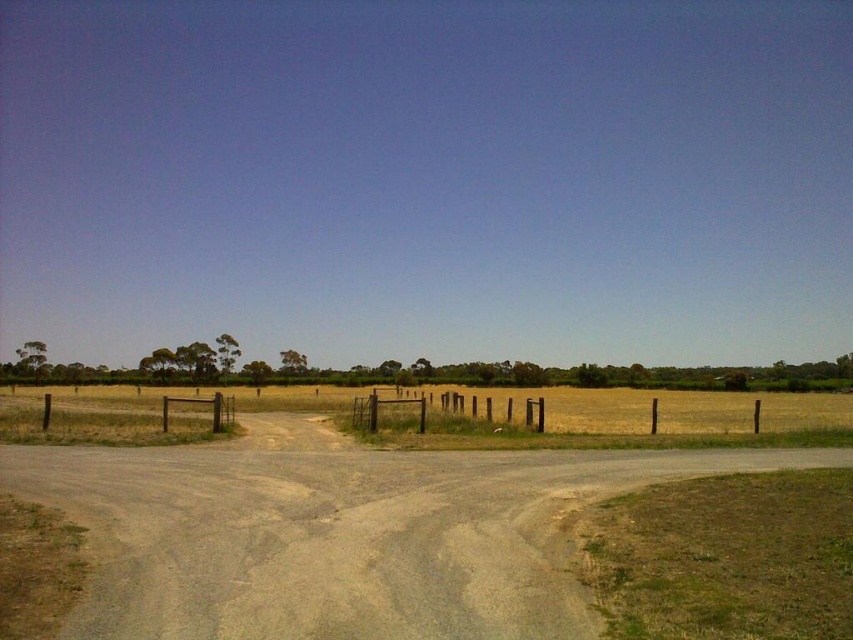
You are a hiker trying to decide which path to take at the fork in the dirt road. You notice the yellow grass at center and the brown wooden fence at center. Which of these two objects is bigger in the image?

The yellow grass at center is larger than the brown wooden fence at center.

You are a hiker trying to decide which path to take. You notice the dull gray gravel at center and the yellow grass at center. Which surface is directly above the other?

The dull gray gravel at center is positioned over yellow grass at center, so the gravel is above the grass.

You are standing at the fork in the dirt road and want to walk towards the yellow grass at center. Which direction should you go to avoid stepping on the dull gray gravel at center?

The dull gray gravel at center is closer to the viewer than the yellow grass at center, so to avoid stepping on the gravel, you should move towards the yellow grass at center by going around it since the gravel is in front of the grass.